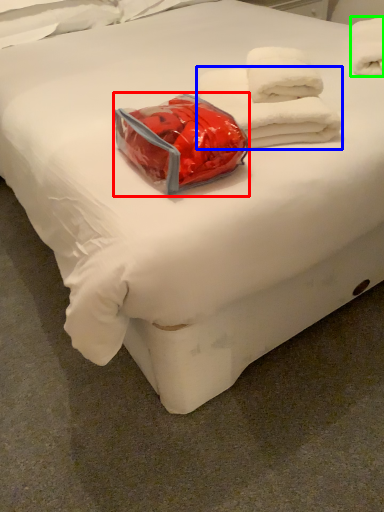
Question: Which is farther away from package (highlighted by a red box)? towel (highlighted by a blue box) or towel (highlighted by a green box)?

Choices:
 (A) towel
 (B) towel

Answer: (B)